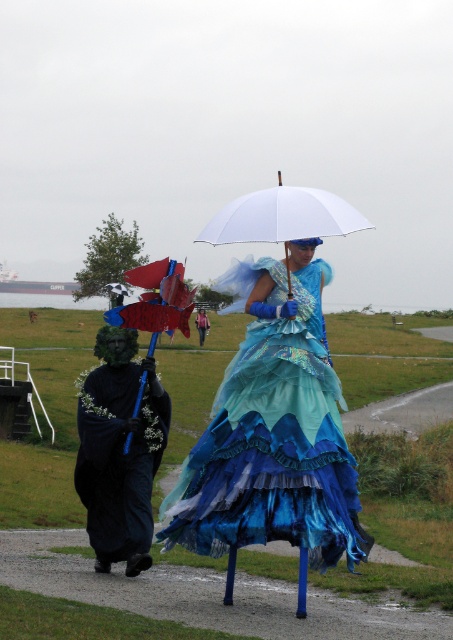
Question: Which of these objects is positioned farthest from the smooth asphalt path at center?

Choices:
 (A) black matte/velvet robe at left
 (B) matte blue umbrella at center

Answer: (B)

Question: Is shiny blue fabric dress at center further to the viewer compared to matte blue umbrella at center?

Choices:
 (A) no
 (B) yes

Answer: (A)

Question: Considering the real-world distances, which object is farthest from the shiny blue fabric dress at center?

Choices:
 (A) white matte umbrella at upper center
 (B) matte blue umbrella at center
 (C) smooth asphalt path at center
 (D) black matte/velvet robe at left

Answer: (A)

Question: Can you confirm if smooth asphalt path at center is positioned above matte blue umbrella at center?

Choices:
 (A) yes
 (B) no

Answer: (B)

Question: Which point is closer to the camera?

Choices:
 (A) shiny blue fabric dress at center
 (B) smooth asphalt path at center

Answer: (A)

Question: Does smooth asphalt path at center have a greater width compared to black matte/velvet robe at left?

Choices:
 (A) no
 (B) yes

Answer: (B)